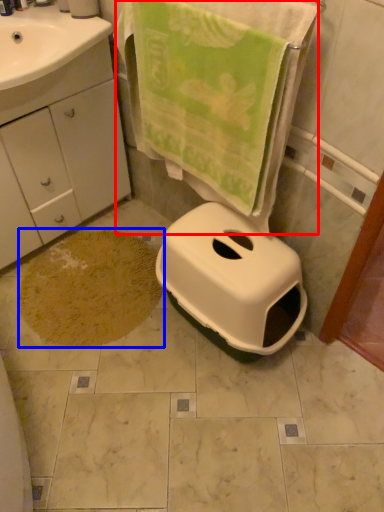
Question: Which point is further to the camera, beach towel (highlighted by a red box) or bath mat (highlighted by a blue box)?

Choices:
 (A) beach towel
 (B) bath mat

Answer: (B)